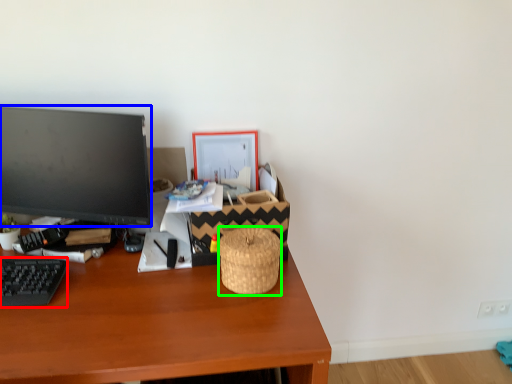
Question: Estimate the real-world distances between objects in this image. Which object is farther from computer keyboard (highlighted by a red box), television (highlighted by a blue box) or basket (highlighted by a green box)?

Choices:
 (A) television
 (B) basket

Answer: (B)